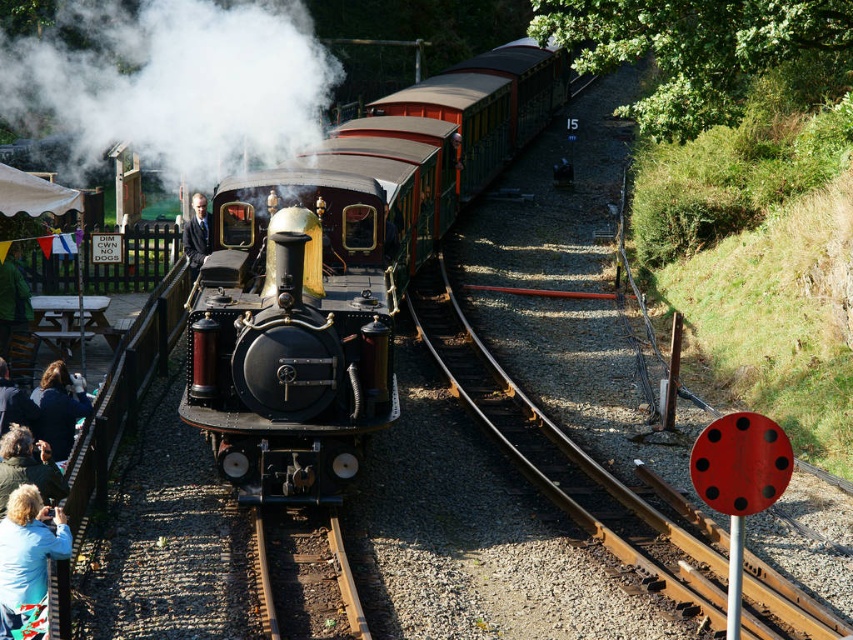
Consider the image. Who is positioned more to the left, blue fabric at lower left or dark blue jacket at lower left?

From the viewer's perspective, dark blue jacket at lower left appears more on the left side.

Between blue fabric at lower left and dark blue jacket at lower left, which one appears on the right side from the viewer's perspective?

blue fabric at lower left is more to the right.

Consider the image. Who is more distant from viewer, [39,497] or [57,381]?

The point [57,381] is behind.

Where is `blue fabric at lower left`? blue fabric at lower left is located at coordinates (27, 563).

Is polished brass steam locomotive at center taller than dark suit at center?

Indeed, polished brass steam locomotive at center has a greater height compared to dark suit at center.

Which is more to the left, polished brass steam locomotive at center or dark suit at center?

dark suit at center

The width and height of the screenshot is (853, 640). What are the coordinates of `polished brass steam locomotive at center` in the screenshot? It's located at point(289,364).

Between point (335, 390) and point (38, 541), which one is positioned behind?

Positioned behind is point (335, 390).

Is polished brass steam engine at center bigger than blue fabric at lower left?

Indeed, polished brass steam engine at center has a larger size compared to blue fabric at lower left.

Between point (380, 225) and point (18, 579), which one is positioned in front?

Point (18, 579)

Find the location of `polished brass steam engine at center`. polished brass steam engine at center is located at coordinates (341, 272).